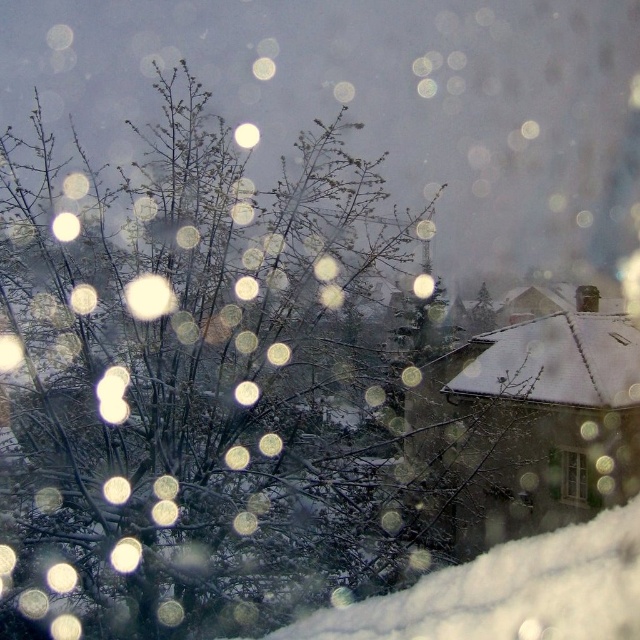
Which is more to the right, white fluffy snow at lower right or clear glass window at lower right?

clear glass window at lower right is more to the right.

Which is in front, point (388, 600) or point (579, 474)?

Positioned in front is point (388, 600).

What do you see at coordinates (509, 593) in the screenshot? I see `white fluffy snow at lower right` at bounding box center [509, 593].

You are a GUI agent. You are given a task and a screenshot of the screen. Output one action in this format:
    pyautogui.click(x=<x>, y=<y>)
    Task: Click on the white fluffy snow at lower right
    
    Given the screenshot: What is the action you would take?
    pyautogui.click(x=509, y=593)